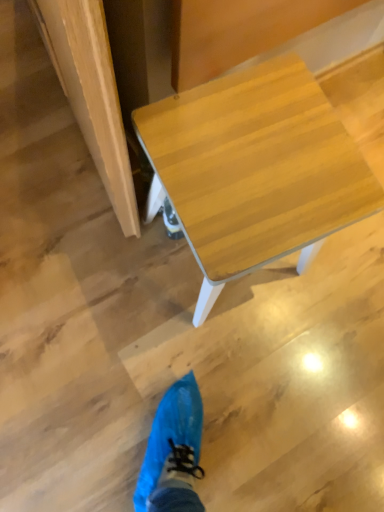
The width and height of the screenshot is (384, 512). What are the coordinates of `free space in front of light wood table at center` in the screenshot? It's located at (197, 358).